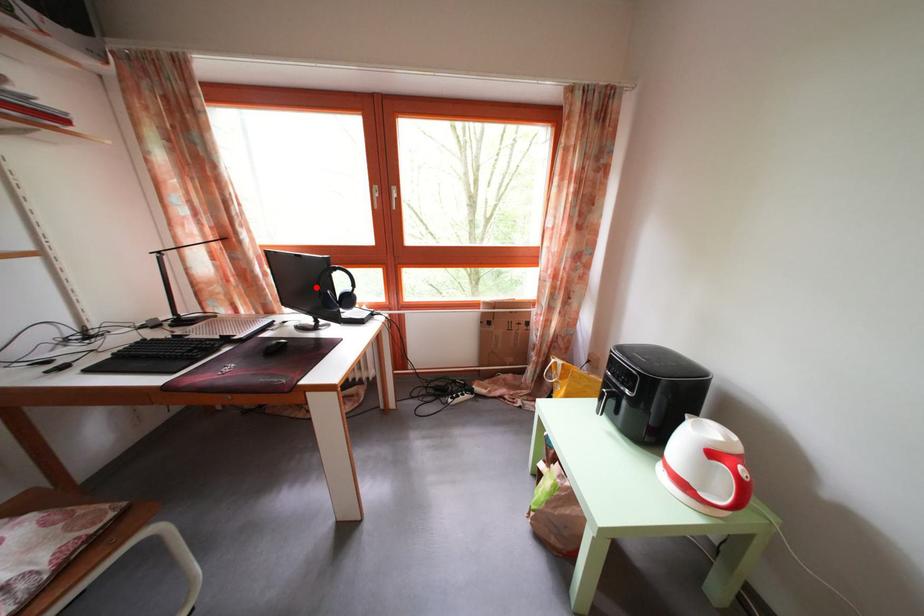
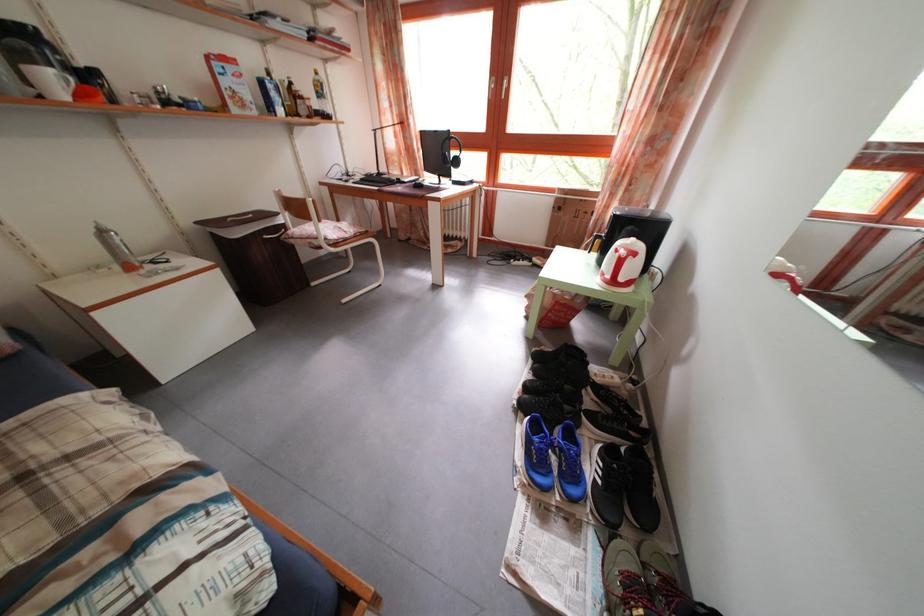
Question: I am providing you with two images of the same scene from different viewpoints. Given a red point in image1, look at the same physical point in image2. Is it:

Choices:
 (A) Closer to the viewpoint
 (B) Farther from the viewpoint

Answer: (A)